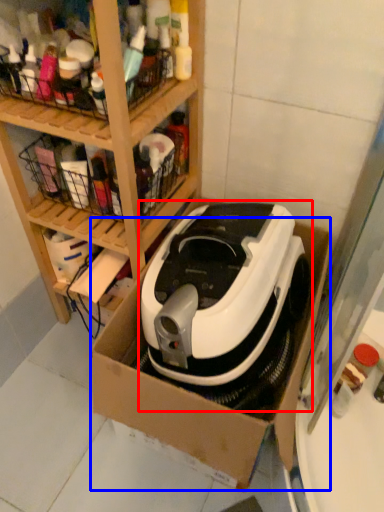
Question: Which object is further to the camera taking this photo, home appliance (highlighted by a red box) or cardboard box (highlighted by a blue box)?

Choices:
 (A) home appliance
 (B) cardboard box

Answer: (A)